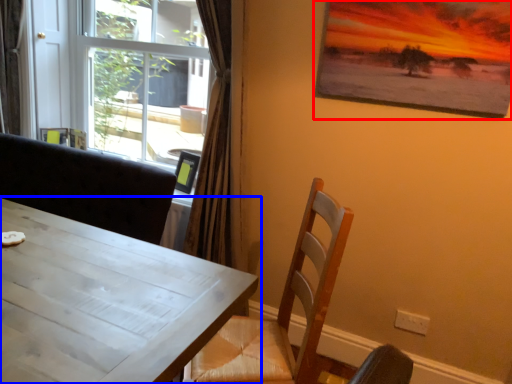
Question: Which point is closer to the camera, picture frame (highlighted by a red box) or table (highlighted by a blue box)?

Choices:
 (A) picture frame
 (B) table

Answer: (B)